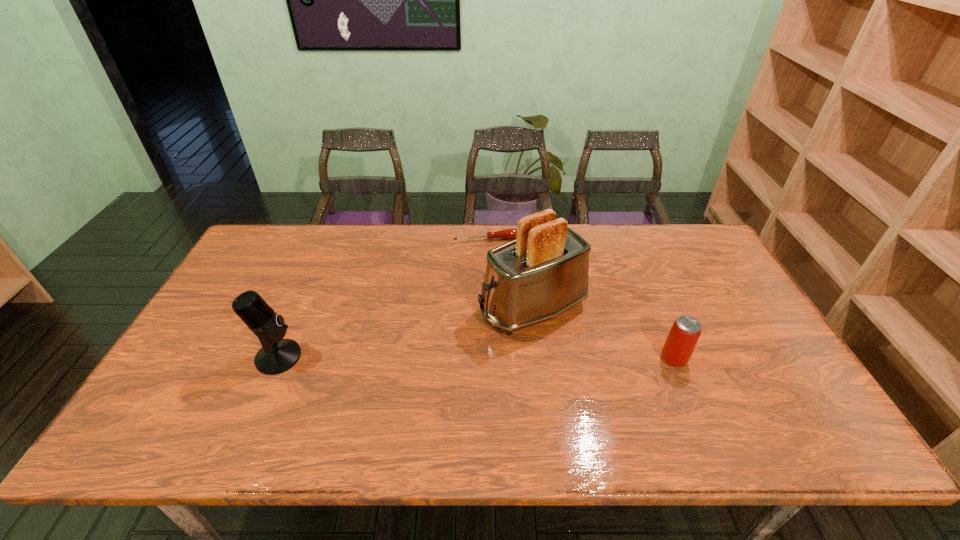
You are a GUI agent. You are given a task and a screenshot of the screen. Output one action in this format:
    pyautogui.click(x=<x>, y=<y>)
    Task: Click on the free space on the desktop that is between the leftmost object and the second shortest object and is positioned on the side of the toaster with the control lever
    The image size is (960, 540).
    Given the screenshot: What is the action you would take?
    pyautogui.click(x=418, y=357)

Identify the location of free space on the desktop that is between the third shortest object and the beer can and is positioned at the tip of the screwdriver. The image size is (960, 540). (522, 358).